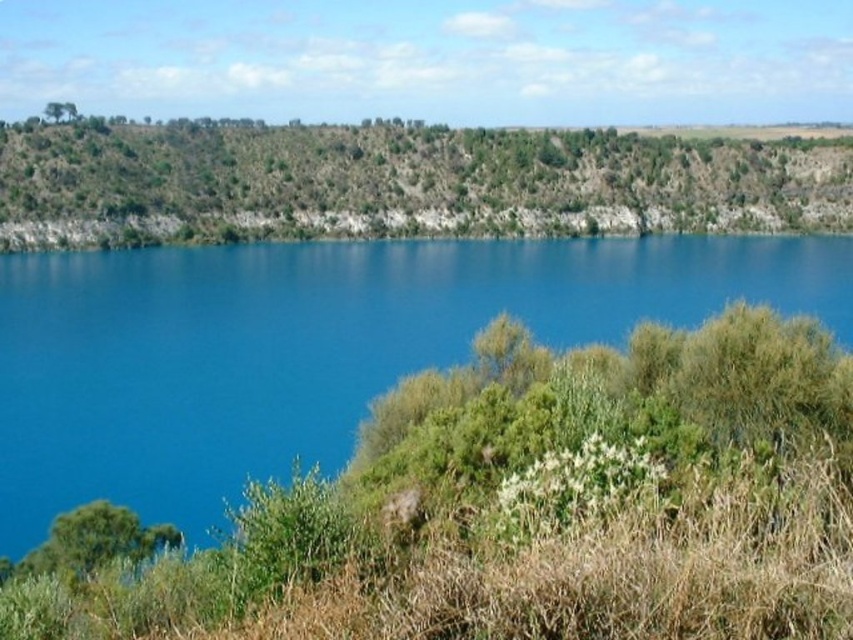
You are standing at the edge of the blue water at center and want to walk to the green grassy hillside at upper center. Which direction should you head to reach the hillside first?

The blue water at center is narrower than the green grassy hillside at upper center, so you should head towards the direction of the green grassy hillside at upper center to reach it first.

You are standing at the center of the image and want to reach both the point at coordinates [357,397] and the point at coordinates [463,168]. Which point will you reach first?

You will reach the point at coordinates [357,397] first because it is closer to the camera than the point at coordinates [463,168].